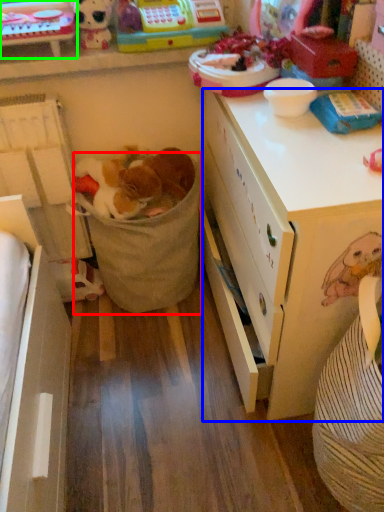
Question: Which is nearer to the laundry basket (highlighted by a red box)? desk (highlighted by a blue box) or cabinetry (highlighted by a green box).

Choices:
 (A) desk
 (B) cabinetry

Answer: (A)